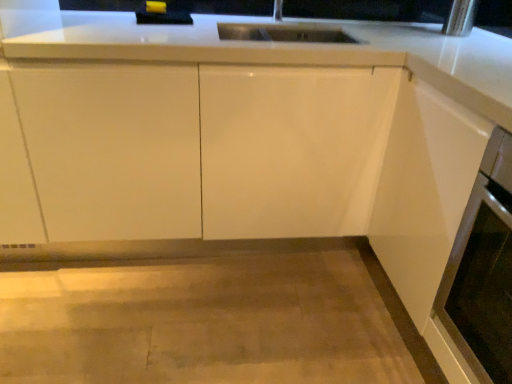
Question: From the image's perspective, is white glossy cabinet at center under satin white oven at lower right?

Choices:
 (A) yes
 (B) no

Answer: (B)

Question: Is white glossy cabinet at center turned away from satin white oven at lower right?

Choices:
 (A) yes
 (B) no

Answer: (B)

Question: From the image's perspective, is white glossy cabinet at center located above satin white oven at lower right?

Choices:
 (A) no
 (B) yes

Answer: (B)

Question: Is white glossy cabinet at center facing towards satin white oven at lower right?

Choices:
 (A) no
 (B) yes

Answer: (B)

Question: Is white glossy cabinet at center surrounding satin white oven at lower right?

Choices:
 (A) yes
 (B) no

Answer: (B)

Question: Is white glossy cabinet at center not close to satin white oven at lower right?

Choices:
 (A) no
 (B) yes

Answer: (A)

Question: Considering the relative positions of satin white oven at lower right and white glossy cabinet at center in the image provided, is satin white oven at lower right in front of white glossy cabinet at center?

Choices:
 (A) no
 (B) yes

Answer: (B)

Question: Is satin white oven at lower right not near white glossy cabinet at center?

Choices:
 (A) no
 (B) yes

Answer: (A)

Question: Is satin white oven at lower right positioned beyond the bounds of white glossy cabinet at center?

Choices:
 (A) no
 (B) yes

Answer: (B)

Question: Considering the relative positions of satin white oven at lower right and white glossy cabinet at center in the image provided, is satin white oven at lower right to the left of white glossy cabinet at center from the viewer's perspective?

Choices:
 (A) no
 (B) yes

Answer: (A)

Question: Is satin white oven at lower right smaller than white glossy cabinet at center?

Choices:
 (A) yes
 (B) no

Answer: (A)

Question: From the image's perspective, is satin white oven at lower right located beneath white glossy cabinet at center?

Choices:
 (A) no
 (B) yes

Answer: (B)

Question: From a real-world perspective, is white glossy cabinet at center physically located above or below satin white oven at lower right?

Choices:
 (A) above
 (B) below

Answer: (B)